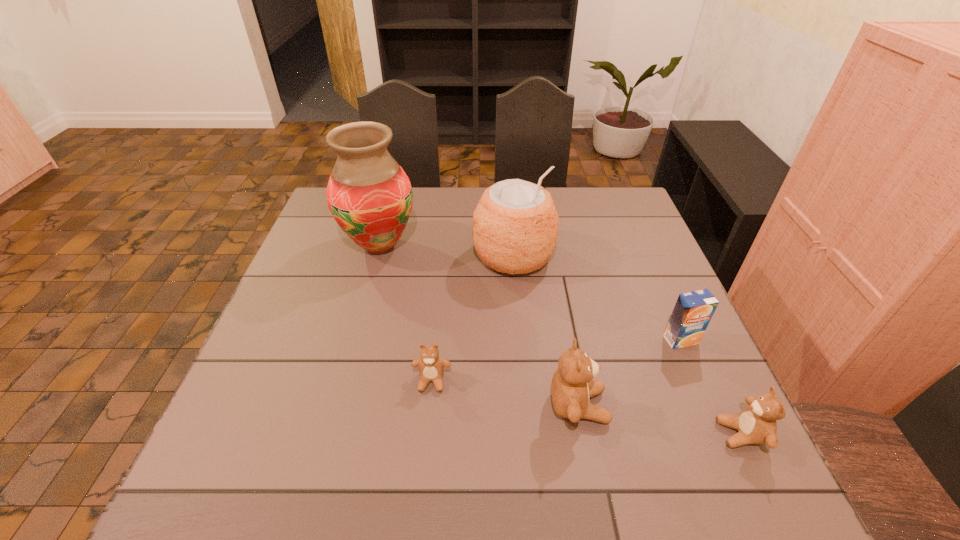
I want to click on vacant region located 0.130m on the front-facing side of the fourth shortest object, so click(671, 406).

Identify the location of vacant space located 0.150m on the front-facing side of the rightmost teddy bear. (641, 434).

At what (x,y) coordinates should I click in order to perform the action: click on vacant region located on the front-facing side of the rightmost teddy bear. Please return your answer as a coordinate pair (x, y). Looking at the image, I should click on (552, 434).

Locate an element on the screen. vacant area situated on the front-facing side of the rightmost teddy bear is located at coordinates (620, 434).

Where is `vacant space located 0.240m on the back of the coconut`? The image size is (960, 540). vacant space located 0.240m on the back of the coconut is located at coordinates (508, 190).

The height and width of the screenshot is (540, 960). I want to click on vacant space located 0.220m on the front of the third farthest object, so click(x=725, y=441).

Find the location of `free location located 0.110m on the back of the leftmost object`. free location located 0.110m on the back of the leftmost object is located at coordinates (392, 204).

Where is `object located at the far edge`? The height and width of the screenshot is (540, 960). object located at the far edge is located at coordinates (369, 195).

Find the location of a particular element. This screenshot has height=540, width=960. object at the left edge is located at coordinates (369, 195).

Identify the location of teddy bear at the right edge. (756, 424).